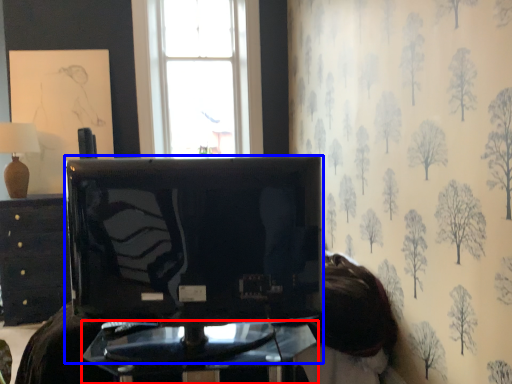
Question: Which of the following is the closest to the observer, furniture (highlighted by a red box) or television (highlighted by a blue box)?

Choices:
 (A) furniture
 (B) television

Answer: (B)